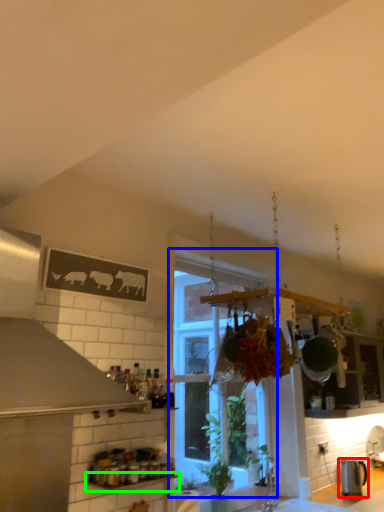
Question: Which object is positioned closest to kitchen appliance (highlighted by a red box)? Select from window (highlighted by a blue box) and window sill (highlighted by a green box).

Choices:
 (A) window
 (B) window sill

Answer: (A)